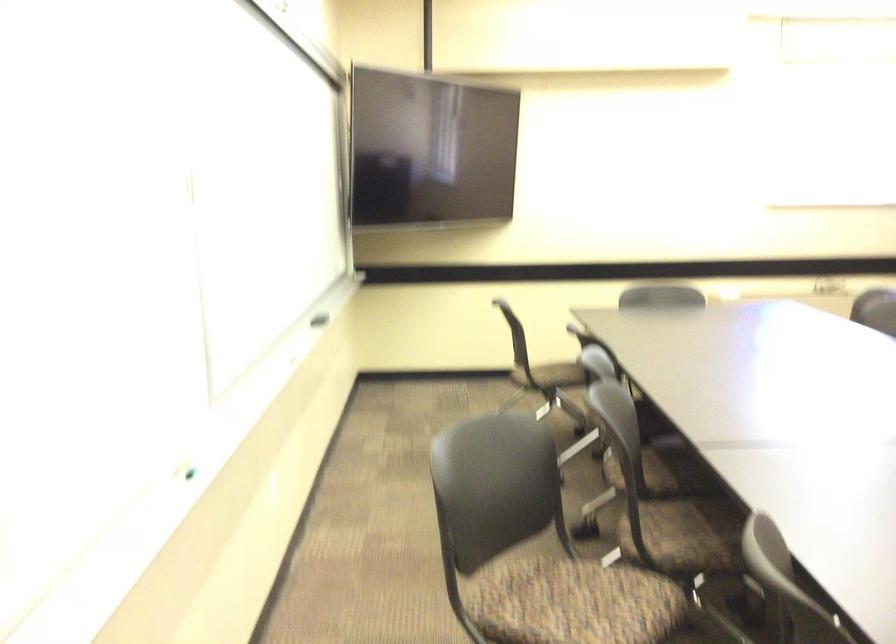
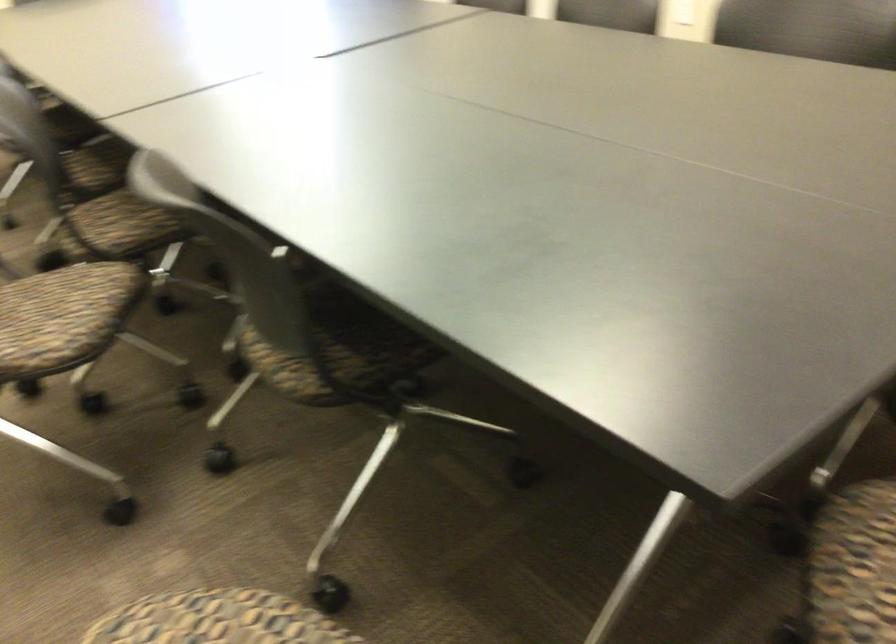
The first image is from the beginning of the video and the second image is from the end. How did the camera likely rotate when shooting the video?

The camera rotated toward right-down.